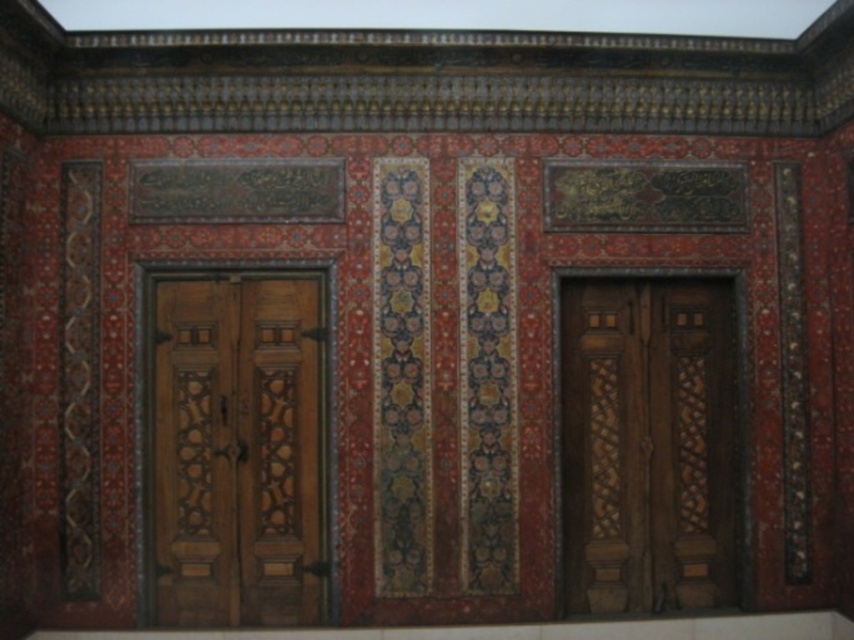
Consider the image. Who is higher up, polished wood door at left or wooden carved door at center?

polished wood door at left is higher up.

The image size is (854, 640). Describe the element at coordinates (238, 449) in the screenshot. I see `polished wood door at left` at that location.

Where is `polished wood door at left`? Image resolution: width=854 pixels, height=640 pixels. polished wood door at left is located at coordinates (238, 449).